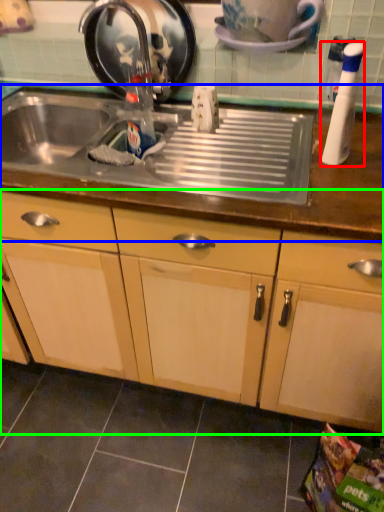
Question: Which object is positioned closest to bottle (highlighted by a red box)? Select from countertop (highlighted by a blue box) and cabinetry (highlighted by a green box).

Choices:
 (A) countertop
 (B) cabinetry

Answer: (A)